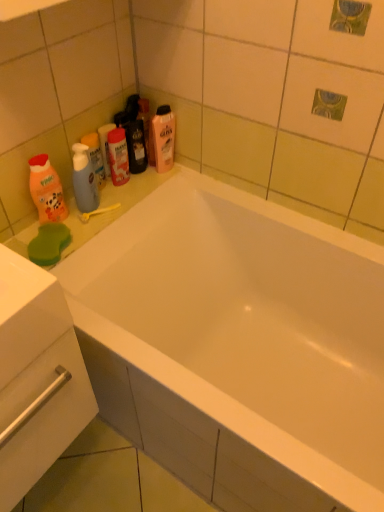
Identify the location of vacant area that lies between translucent plastic mouthwash at upper center, marked as the first mouthwash in a right-to-left arrangement, and yellow plastic toothbrush at upper left. The height and width of the screenshot is (512, 384). (118, 194).